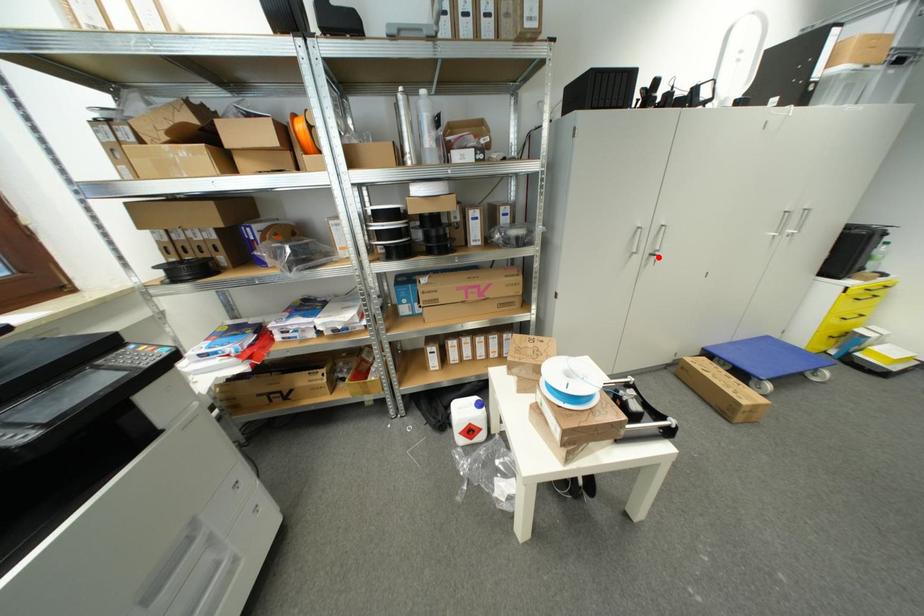
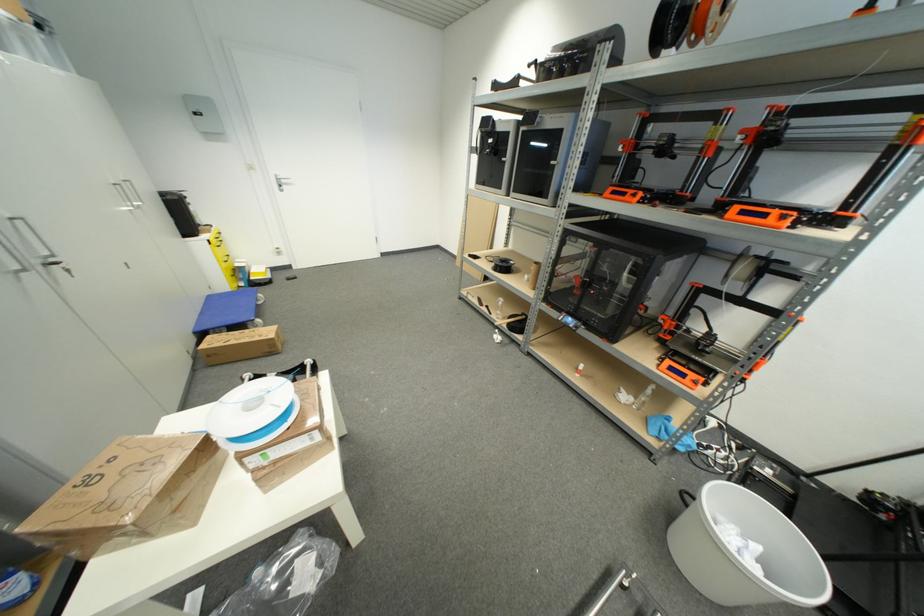
In the second image, find the point that corresponds to the highlighted location in the first image.

(59, 265)